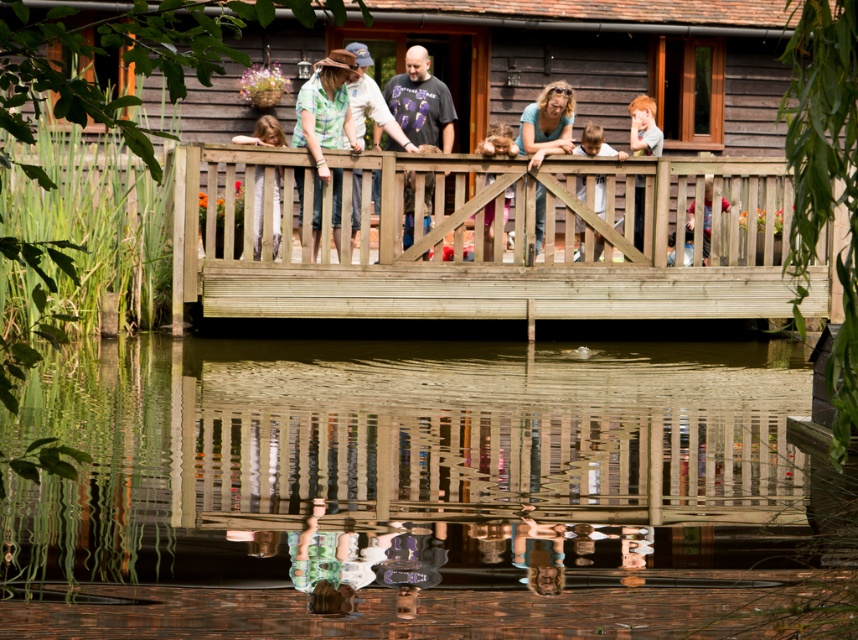
Question: Which point appears farthest from the camera in this image?

Choices:
 (A) (263, 124)
 (B) (594, 129)
 (C) (347, 200)

Answer: (B)

Question: Can you confirm if green tie-dye shirt at center is wider than light brown wooden fence post at center?

Choices:
 (A) yes
 (B) no

Answer: (A)

Question: Does dark gray t-shirt at center have a lesser width compared to light brown wooden fence at upper right?

Choices:
 (A) yes
 (B) no

Answer: (B)

Question: Estimate the real-world distances between objects in this image. Which object is farther from the light brown wooden fence at upper right?

Choices:
 (A) light brown wooden fence post at center
 (B) matte teal shirt at center
 (C) pink fabric at center
 (D) wooden fence at center

Answer: (C)

Question: Which object appears farthest from the camera in this image?

Choices:
 (A) green tie-dye shirt at center
 (B) pink fabric at center

Answer: (B)

Question: Does wooden at center have a smaller size compared to light brown wooden fence post at center?

Choices:
 (A) yes
 (B) no

Answer: (B)